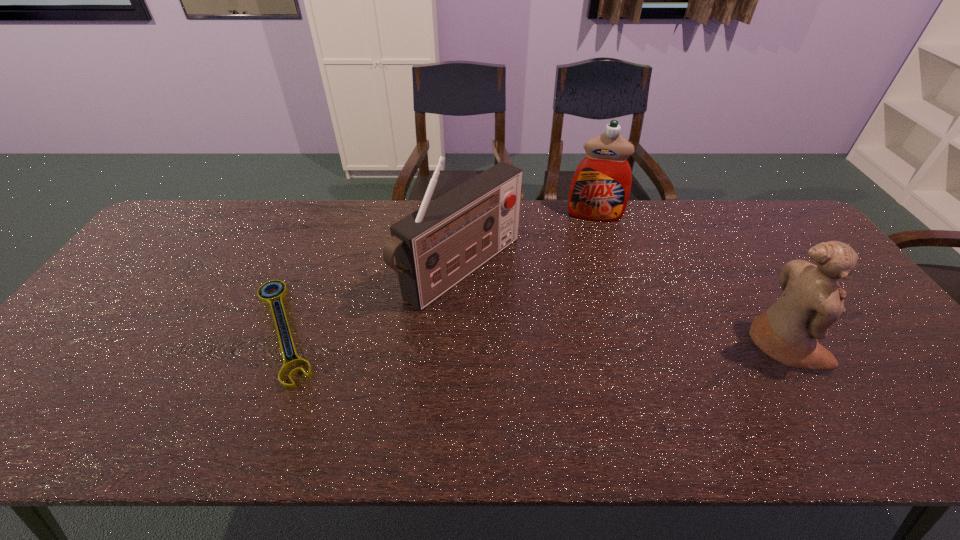
At what (x,y) coordinates should I click in order to perform the action: click on free space on the desktop that is between the wrench and the rightmost object and is positioned on the front surface of the detergent. Please return your answer as a coordinate pair (x, y). The image size is (960, 540). Looking at the image, I should click on (591, 340).

At what (x,y) coordinates should I click in order to perform the action: click on free space on the desktop that is between the shortest object and the rightmost object and is positioned on the front panel of the radio receiver. Please return your answer as a coordinate pair (x, y). This screenshot has width=960, height=540. Looking at the image, I should click on 571,339.